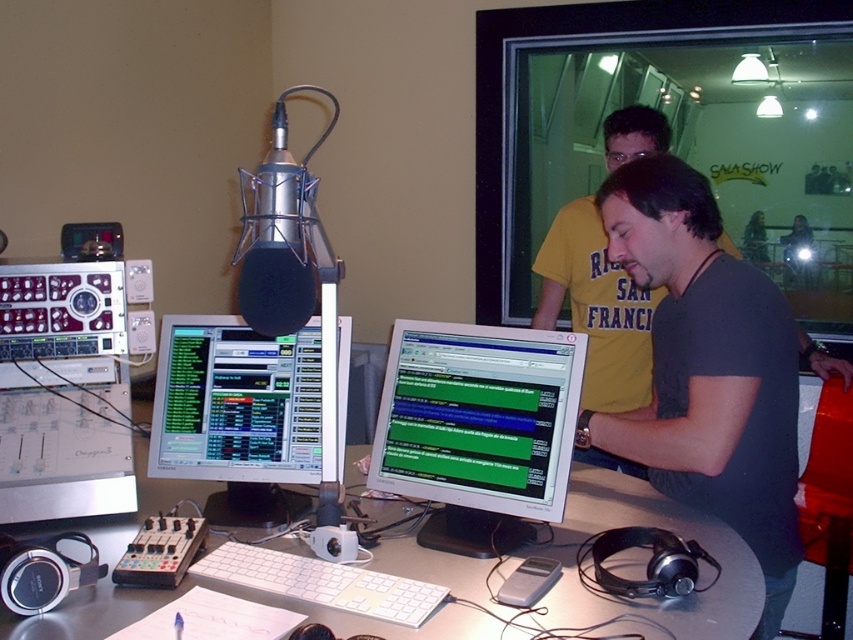
Consider the image. You are a technician in the studio and need to reach the black matte shirt at center to adjust a microphone stand. Considering your arm length is 0.7 meters, can you comfortably reach it from your current position?

The black matte shirt at center is 1.28 meters away from the viewer. Since your arm length is 0.7 meters, you cannot comfortably reach it without moving closer.

You are an audio engineer setting up a studio. You have a matte black monitor at center and a matte black microphone at center on your desk. Which object takes up more vertical space in the studio setup?

The matte black monitor at center is much taller than the matte black microphone at center, so it takes up more vertical space in the studio setup.

Consider the image. You are setting up a new monitor for the recording studio. The current setup has a matte black monitor at center and a matte black microphone at center. Which object should you place first if you want to prioritize the larger item in the center?

The matte black monitor at center should be placed first since it is larger than the matte black microphone at center according to the description.